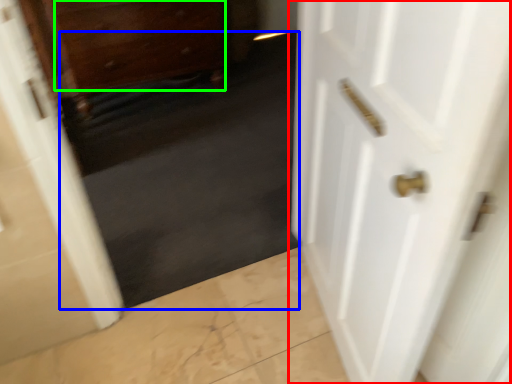
Question: Estimate the real-world distances between objects in this image. Which object is closer to door (highlighted by a red box), dark (highlighted by a blue box) or drawer (highlighted by a green box)?

Choices:
 (A) dark
 (B) drawer

Answer: (A)